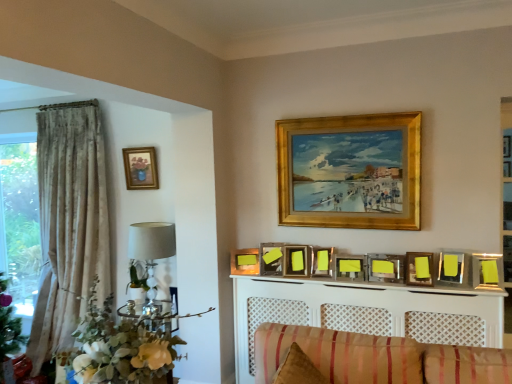
Question: Should I look upward or downward to see matte wood picture frame at upper center, positioned as the fourth picture frame in left-to-right order?

Choices:
 (A) down
 (B) up

Answer: (A)

Question: From a real-world perspective, is yellow matte picture frame at upper center, which ranks as the second picture frame in right-to-left order, located higher than matte yellow picture frame at center, positioned as the 2th picture frame in left-to-right order?

Choices:
 (A) no
 (B) yes

Answer: (B)

Question: Could matte yellow picture frame at center, which appears as the tenth picture frame when viewed from the right, be considered to be inside yellow matte picture frame at upper center, which ranks as the second picture frame in right-to-left order?

Choices:
 (A) no
 (B) yes

Answer: (A)

Question: Can you confirm if yellow matte picture frame at upper center, which ranks as the second picture frame in right-to-left order, is smaller than matte yellow picture frame at center, positioned as the 2th picture frame in left-to-right order?

Choices:
 (A) yes
 (B) no

Answer: (A)

Question: From a real-world perspective, does yellow matte picture frame at upper center, which is the tenth picture frame from left to right, sit lower than matte yellow picture frame at center, positioned as the 2th picture frame in left-to-right order?

Choices:
 (A) yes
 (B) no

Answer: (B)

Question: Would you say yellow matte picture frame at upper center, which ranks as the second picture frame in right-to-left order, is a long distance from matte yellow picture frame at center, positioned as the 2th picture frame in left-to-right order?

Choices:
 (A) no
 (B) yes

Answer: (B)

Question: Is yellow matte picture frame at upper center, which ranks as the second picture frame in right-to-left order, next to matte yellow picture frame at center, positioned as the 2th picture frame in left-to-right order, and touching it?

Choices:
 (A) no
 (B) yes

Answer: (A)

Question: Does yellow paper at center, arranged as the fourth picture frame when viewed from the right, have a smaller size compared to yellow paper at center, which is the 9th picture frame in right-to-left order?

Choices:
 (A) yes
 (B) no

Answer: (A)

Question: From the image's perspective, is yellow paper at center, arranged as the fourth picture frame when viewed from the right, below yellow paper at center, which is the 9th picture frame in right-to-left order?

Choices:
 (A) yes
 (B) no

Answer: (A)

Question: From a real-world perspective, does yellow paper at center, arranged as the fourth picture frame when viewed from the right, sit lower than yellow paper at center, which is the 3th picture frame from left to right?

Choices:
 (A) no
 (B) yes

Answer: (B)

Question: Is yellow paper at center, the eighth picture frame positioned from the left, wider than yellow paper at center, which is the 9th picture frame in right-to-left order?

Choices:
 (A) yes
 (B) no

Answer: (B)

Question: Is yellow paper at center, the eighth picture frame positioned from the left, to the right of yellow paper at center, which is the 3th picture frame from left to right, from the viewer's perspective?

Choices:
 (A) no
 (B) yes

Answer: (B)

Question: Can yellow paper at center, which is the 9th picture frame in right-to-left order, be found inside yellow paper at center, arranged as the fourth picture frame when viewed from the right?

Choices:
 (A) yes
 (B) no

Answer: (B)

Question: Is green leafy floral arrangement at left positioned before matte gold picture frame at upper left, the 11th picture frame when ordered from right to left?

Choices:
 (A) yes
 (B) no

Answer: (A)